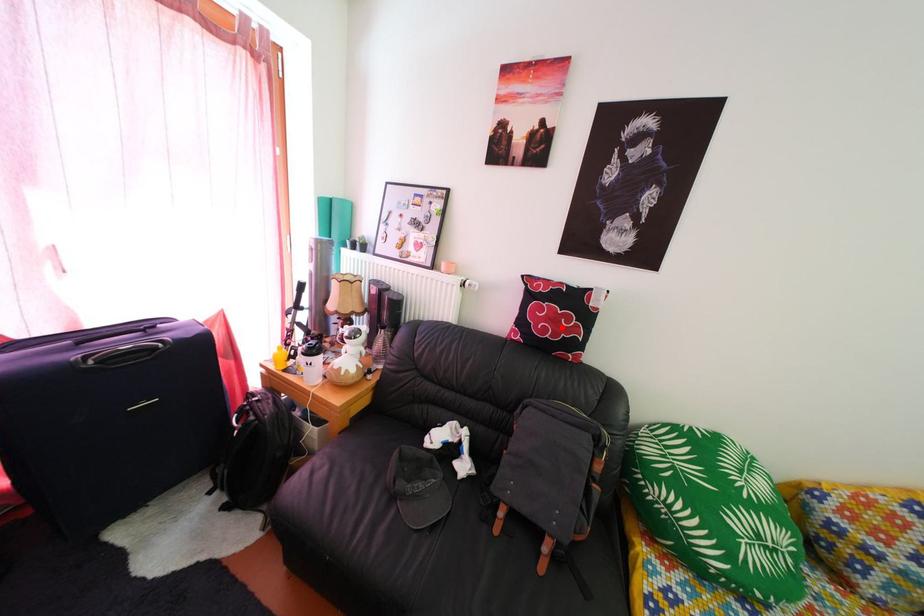
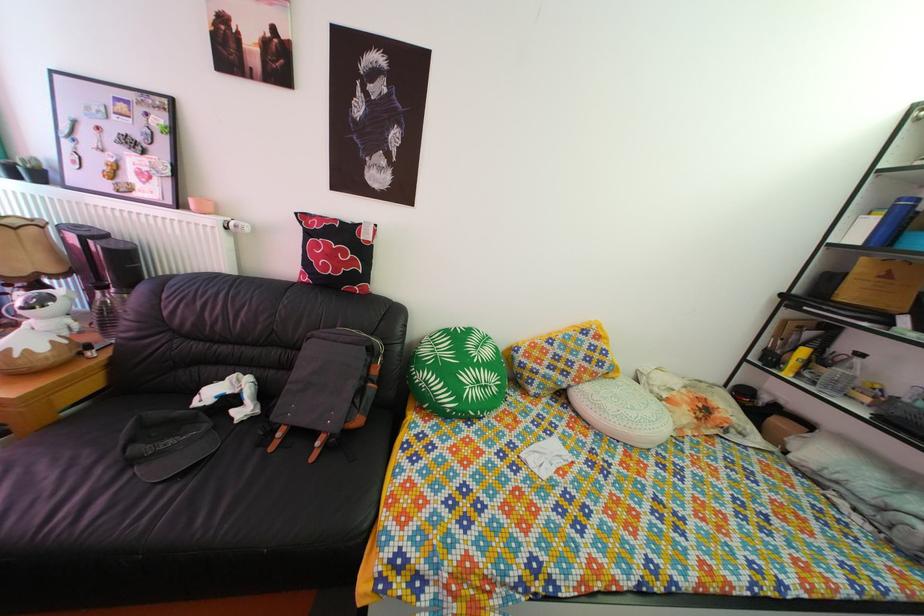
Locate, in the second image, the point that corresponds to the highlighted location in the first image.

(338, 264)